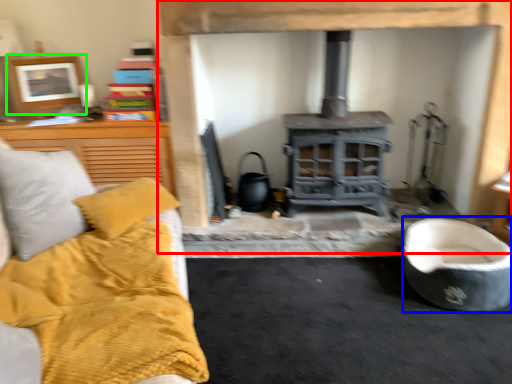
Question: Which object is positioned farthest from fireplace (highlighted by a red box)? Select from rocking chair (highlighted by a blue box) and picture frame (highlighted by a green box).

Choices:
 (A) rocking chair
 (B) picture frame

Answer: (B)